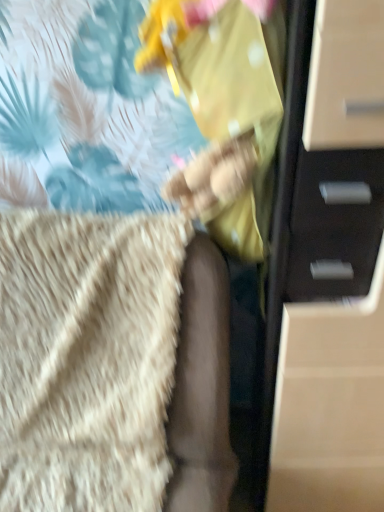
Measure the distance between point (x=136, y=331) and camera.

The distance of point (x=136, y=331) from camera is 37.91 inches.

Image resolution: width=384 pixels, height=512 pixels. What are the coordinates of `beige fluffy blanket at lower left` in the screenshot? It's located at (87, 358).

Describe the element at coordinates (87, 358) in the screenshot. I see `beige fluffy blanket at lower left` at that location.

Measure the distance between beige fluffy blanket at lower left and camera.

beige fluffy blanket at lower left and camera are 35.05 inches apart.

What is the approximate width of beige fluffy blanket at lower left?

The width of beige fluffy blanket at lower left is 29.71 inches.

Find the location of `matte black chest of drawers at right`. matte black chest of drawers at right is located at coordinates [x=329, y=267].

Measure the distance between point [377,55] and camera.

Point [377,55] and camera are 22.80 inches apart from each other.

What do you see at coordinates (329, 267) in the screenshot? The width and height of the screenshot is (384, 512). I see `matte black chest of drawers at right` at bounding box center [329, 267].

Find the location of `beige fluffy blanket at lower left`. beige fluffy blanket at lower left is located at coordinates [x=87, y=358].

Between matte black chest of drawers at right and beige fluffy blanket at lower left, which one appears on the right side from the viewer's perspective?

matte black chest of drawers at right.

Relative to beige fluffy blanket at lower left, is matte black chest of drawers at right in front or behind?

In the image, matte black chest of drawers at right appears behind beige fluffy blanket at lower left.

Considering the positions of point (337, 217) and point (34, 462), is point (337, 217) closer or farther from the camera than point (34, 462)?

Point (337, 217) appears to be closer to the viewer than point (34, 462).

From the image's perspective, is matte black chest of drawers at right beneath beige fluffy blanket at lower left?

Incorrect, from the image's perspective, matte black chest of drawers at right is higher than beige fluffy blanket at lower left.

From a real-world perspective, which object rests below the other?

beige fluffy blanket at lower left.

Is matte black chest of drawers at right wider than beige fluffy blanket at lower left?

In fact, matte black chest of drawers at right might be narrower than beige fluffy blanket at lower left.

Is matte black chest of drawers at right taller than beige fluffy blanket at lower left?

Indeed, matte black chest of drawers at right has a greater height compared to beige fluffy blanket at lower left.

Which of these two, matte black chest of drawers at right or beige fluffy blanket at lower left, is bigger?

Bigger between the two is beige fluffy blanket at lower left.

From the picture: Is beige fluffy blanket at lower left a part of matte black chest of drawers at right?

No.

Is matte black chest of drawers at right in contact with beige fluffy blanket at lower left?

No, matte black chest of drawers at right is not beside beige fluffy blanket at lower left.

Is matte black chest of drawers at right facing towards beige fluffy blanket at lower left?

No, matte black chest of drawers at right is not oriented towards beige fluffy blanket at lower left.

In the scene shown: How distant is matte black chest of drawers at right from beige fluffy blanket at lower left?

matte black chest of drawers at right is 15.93 inches away from beige fluffy blanket at lower left.

In order to click on blanket below the matte black chest of drawers at right (from a real-world perspective) in this screenshot , I will do `click(87, 358)`.

Can you confirm if beige fluffy blanket at lower left is positioned to the left of matte black chest of drawers at right?

Indeed, beige fluffy blanket at lower left is positioned on the left side of matte black chest of drawers at right.

Which object is closer to the camera taking this photo, beige fluffy blanket at lower left or matte black chest of drawers at right?

beige fluffy blanket at lower left is more forward.

Considering the positions of point (151, 466) and point (378, 325), is point (151, 466) closer or farther from the camera than point (378, 325)?

Point (151, 466) is positioned farther from the camera compared to point (378, 325).

From the image's perspective, would you say beige fluffy blanket at lower left is shown under matte black chest of drawers at right?

Yes, from the image's perspective, beige fluffy blanket at lower left is below matte black chest of drawers at right.

From a real-world perspective, which object stands above the other?

In real-world perspective, matte black chest of drawers at right is above.

Considering the sizes of beige fluffy blanket at lower left and matte black chest of drawers at right in the image, is beige fluffy blanket at lower left wider or thinner than matte black chest of drawers at right?

In the image, beige fluffy blanket at lower left appears to be wider than matte black chest of drawers at right.

From the picture: Can you confirm if beige fluffy blanket at lower left is taller than matte black chest of drawers at right?

Incorrect, the height of beige fluffy blanket at lower left is not larger of that of matte black chest of drawers at right.

Is beige fluffy blanket at lower left bigger than matte black chest of drawers at right?

Indeed, beige fluffy blanket at lower left has a larger size compared to matte black chest of drawers at right.

In the scene shown: Is beige fluffy blanket at lower left not within matte black chest of drawers at right?

Indeed, beige fluffy blanket at lower left is completely outside matte black chest of drawers at right.

Is beige fluffy blanket at lower left not close to matte black chest of drawers at right?

Actually, beige fluffy blanket at lower left and matte black chest of drawers at right are a little close together.

Consider the image. Does beige fluffy blanket at lower left turn towards matte black chest of drawers at right?

No, beige fluffy blanket at lower left is not facing towards matte black chest of drawers at right.

How different are the orientations of beige fluffy blanket at lower left and matte black chest of drawers at right in degrees?

The angle between the facing direction of beige fluffy blanket at lower left and the facing direction of matte black chest of drawers at right is 3.49 degrees.

Locate an element on the screen. This screenshot has height=512, width=384. blanket below the matte black chest of drawers at right (from a real-world perspective) is located at coordinates (87, 358).

Where is `chest of drawers behind the beige fluffy blanket at lower left`? Image resolution: width=384 pixels, height=512 pixels. chest of drawers behind the beige fluffy blanket at lower left is located at coordinates (329, 267).

The height and width of the screenshot is (512, 384). In order to click on chest of drawers lying on the right of beige fluffy blanket at lower left in this screenshot , I will do [x=329, y=267].